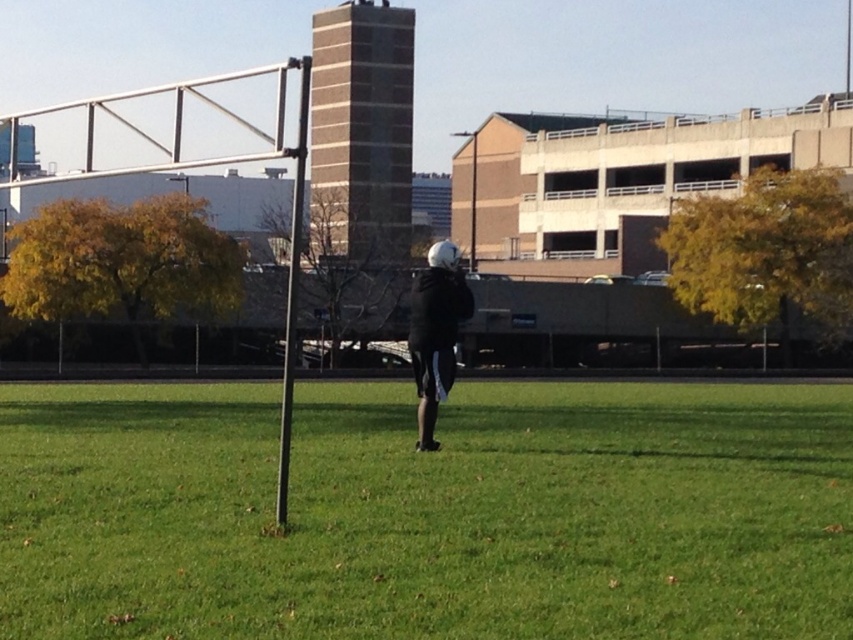
Question: Which object appears closest to the camera in this image?

Choices:
 (A) green grass at center
 (B) black matte jacket at center

Answer: (A)

Question: Is green grass at center further to camera compared to black matte jacket at center?

Choices:
 (A) no
 (B) yes

Answer: (A)

Question: Is green grass at center further to camera compared to black matte jacket at center?

Choices:
 (A) yes
 (B) no

Answer: (B)

Question: Can you confirm if green grass at center is positioned to the left of black matte jacket at center?

Choices:
 (A) yes
 (B) no

Answer: (B)

Question: Among these objects, which one is farthest from the camera?

Choices:
 (A) black matte jacket at center
 (B) green grass at center

Answer: (A)